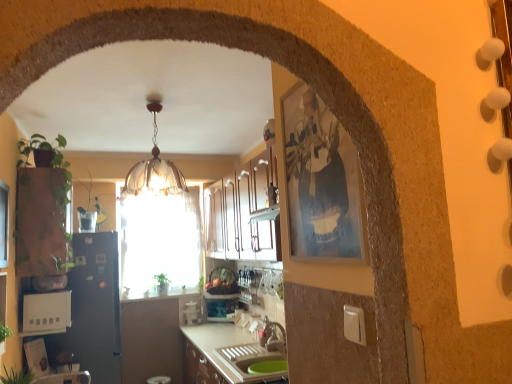
Question: Considering the relative sizes of green matte plant at left, the 2th plant when ordered from back to front, and black matte refrigerator at left, the 2th appliance positioned from the right, in the image provided, is green matte plant at left, the 2th plant when ordered from back to front, smaller than black matte refrigerator at left, the 2th appliance positioned from the right,?

Choices:
 (A) yes
 (B) no

Answer: (A)

Question: From the image's perspective, is green matte plant at left, placed as the 1th plant when sorted from top to bottom, beneath black matte refrigerator at left, placed as the 2th appliance when sorted from front to back?

Choices:
 (A) no
 (B) yes

Answer: (A)

Question: From the image's perspective, is green matte plant at left, placed as the 1th plant when sorted from top to bottom, above black matte refrigerator at left, which ranks as the 2th appliance in back-to-front order?

Choices:
 (A) yes
 (B) no

Answer: (A)

Question: Does green matte plant at left, which ranks as the third plant in bottom-to-top order, appear on the left side of black matte refrigerator at left, the 2th appliance positioned from the right?

Choices:
 (A) no
 (B) yes

Answer: (A)

Question: Is green matte plant at left, which ranks as the third plant in bottom-to-top order, outside of black matte refrigerator at left, the 2th appliance positioned from the right?

Choices:
 (A) yes
 (B) no

Answer: (A)

Question: Would you say white glossy countertop at center is inside or outside white plastic toaster at lower left, which is counted as the 1th appliance, starting from the front?

Choices:
 (A) inside
 (B) outside

Answer: (B)

Question: Visually, is white glossy countertop at center positioned to the left or to the right of white plastic toaster at lower left, the 1th appliance from the left?

Choices:
 (A) right
 (B) left

Answer: (A)

Question: From a real-world perspective, relative to white plastic toaster at lower left, marked as the 3th appliance in a right-to-left arrangement, is white glossy countertop at center vertically above or below?

Choices:
 (A) below
 (B) above

Answer: (A)

Question: Is point (244, 357) closer or farther from the camera than point (42, 332)?

Choices:
 (A) farther
 (B) closer

Answer: (A)

Question: Is white plastic toaster at lower left, which is counted as the 1th appliance, starting from the front, bigger or smaller than wooden picture frame at right?

Choices:
 (A) small
 (B) big

Answer: (B)

Question: Considering the positions of white plastic toaster at lower left, which is counted as the 3th appliance, starting from the back, and wooden picture frame at right in the image, is white plastic toaster at lower left, which is counted as the 3th appliance, starting from the back, taller or shorter than wooden picture frame at right?

Choices:
 (A) short
 (B) tall

Answer: (A)

Question: From a real-world perspective, relative to wooden picture frame at right, is white plastic toaster at lower left, marked as the 3th appliance in a right-to-left arrangement, vertically above or below?

Choices:
 (A) above
 (B) below

Answer: (B)

Question: Which is correct: white plastic toaster at lower left, the 1th appliance from the left, is inside wooden picture frame at right, or outside of it?

Choices:
 (A) inside
 (B) outside

Answer: (B)

Question: Is green leafy plant at center, which is the 1th plant in bottom-to-top order, bigger or smaller than metallic silver toaster at center, the first appliance when ordered from back to front?

Choices:
 (A) big
 (B) small

Answer: (B)

Question: From the image's perspective, is green leafy plant at center, positioned as the first plant in back-to-front order, positioned above or below metallic silver toaster at center, the first appliance when ordered from back to front?

Choices:
 (A) above
 (B) below

Answer: (A)